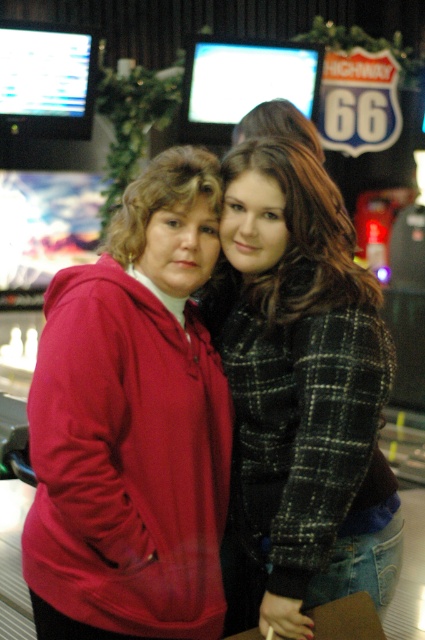
Question: Which of these objects is positioned closest to the dark brown hair at center?

Choices:
 (A) matte red hoodie at center
 (B) plaid fabric jacket at center

Answer: (B)

Question: Does matte red hoodie at center have a lesser width compared to plaid fabric jacket at center?

Choices:
 (A) no
 (B) yes

Answer: (B)

Question: From the image, what is the correct spatial relationship of plaid fabric jacket at center in relation to dark brown hair at center?

Choices:
 (A) below
 (B) above

Answer: (A)

Question: Does matte red hoodie at center appear on the left side of plaid fabric jacket at center?

Choices:
 (A) yes
 (B) no

Answer: (A)

Question: Among these points, which one is farthest from the camera?

Choices:
 (A) (323, 424)
 (B) (163, 618)

Answer: (B)

Question: Which object appears farthest from the camera in this image?

Choices:
 (A) dark brown hair at center
 (B) matte red hoodie at center

Answer: (A)